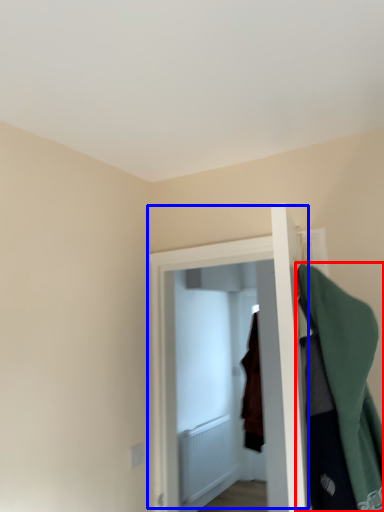
Question: Which object is further to the camera taking this photo, cloak (highlighted by a red box) or door (highlighted by a blue box)?

Choices:
 (A) cloak
 (B) door

Answer: (B)